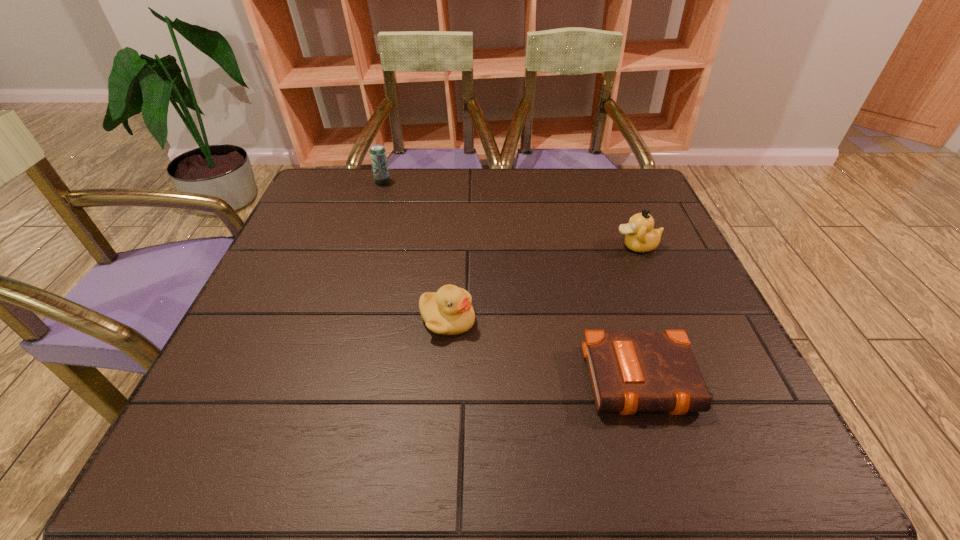
You are a GUI agent. You are given a task and a screenshot of the screen. Output one action in this format:
    pyautogui.click(x=<x>, y=<y>)
    Task: Click on the free spot located 0.370m on the face of the farther duckling
    The width and height of the screenshot is (960, 540).
    Given the screenshot: What is the action you would take?
    pyautogui.click(x=462, y=246)

Locate an element on the screen. The height and width of the screenshot is (540, 960). free space located on the face of the farther duckling is located at coordinates (449, 246).

Locate an element on the screen. This screenshot has width=960, height=540. free location located 0.360m on the beak of the left duckling is located at coordinates (653, 320).

At what (x,y) coordinates should I click in order to perform the action: click on vacant area situated 0.060m on the spine side of the Bible. Please return your answer as a coordinate pair (x, y). This screenshot has width=960, height=540. Looking at the image, I should click on (669, 456).

At what (x,y) coordinates should I click in order to perform the action: click on object present at the far edge. Please return your answer as a coordinate pair (x, y). The height and width of the screenshot is (540, 960). Looking at the image, I should click on (378, 157).

You are a GUI agent. You are given a task and a screenshot of the screen. Output one action in this format:
    pyautogui.click(x=<x>, y=<y>)
    Task: Click on the object at the near edge
    
    Given the screenshot: What is the action you would take?
    pyautogui.click(x=630, y=372)

Identify the location of duckling situated at the right edge. The image size is (960, 540). (640, 236).

Where is `Bible that is positioned at the right edge`? The image size is (960, 540). Bible that is positioned at the right edge is located at coordinates (630, 372).

This screenshot has width=960, height=540. Identify the location of object situated at the near right corner. (630, 372).

Where is `free space at the far edge of the desktop`? The height and width of the screenshot is (540, 960). free space at the far edge of the desktop is located at coordinates (582, 169).